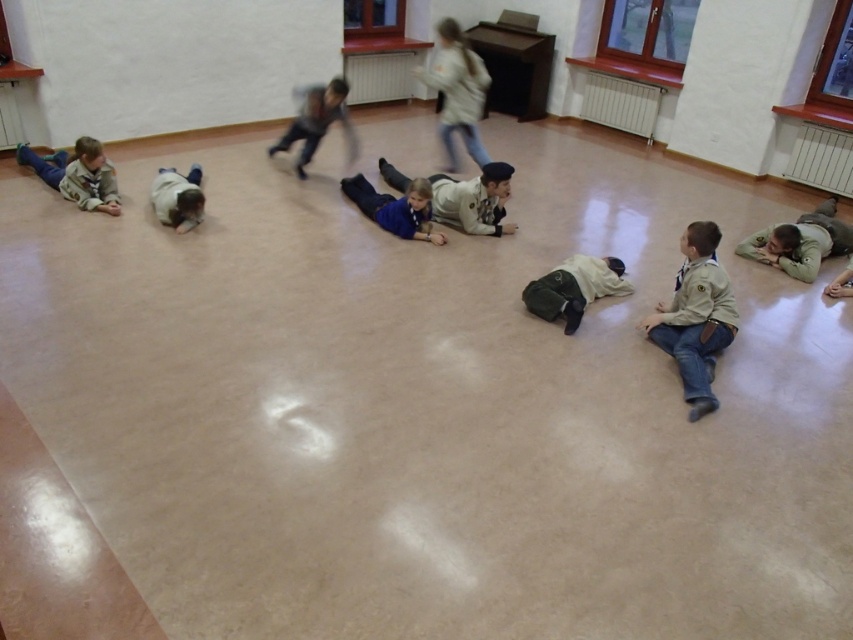
You are a teacher observing the children in the room. You notice two uniforms in the scene. Which uniform is taller between the matte khaki uniform at center and the light brown uniform at left?

The matte khaki uniform at center is taller than the light brown uniform at left according to the description.

You are standing at the entrance of the room and see two points marked on the floor. The first point is at coordinates point (549,307) and the second point is at point (115,204). Which point is closer to you?

Point (115,204) is closer to you because it is behind point (549,307), meaning the latter is further away.